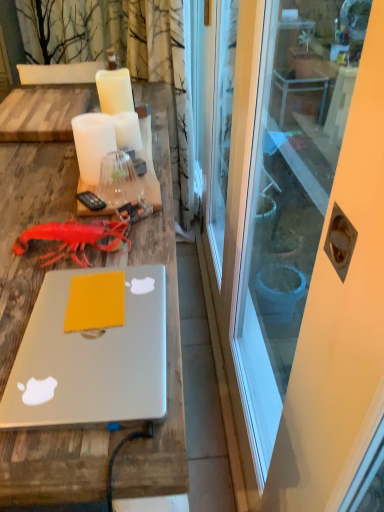
Where is `vacant area to the right of yellow matte notepad at center`? This screenshot has height=512, width=384. vacant area to the right of yellow matte notepad at center is located at coordinates (143, 298).